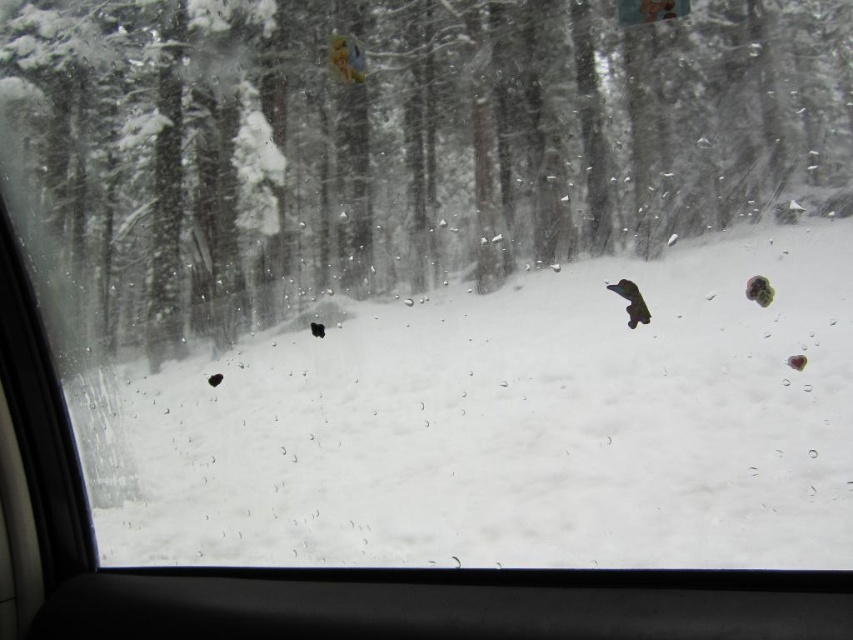
Is snowy bark tree at center positioned behind white matte snow at center?

No, it is not.

Which is behind, point (403, 4) or point (758, 465)?

Positioned behind is point (403, 4).

The width and height of the screenshot is (853, 640). I want to click on snowy bark tree at center, so click(x=395, y=140).

Is the position of snowy bark tree at center more distant than that of green fuzzy animal at right?

No, it is in front of green fuzzy animal at right.

Where is `snowy bark tree at center`? Image resolution: width=853 pixels, height=640 pixels. snowy bark tree at center is located at coordinates (395, 140).

Between white matte snow at center and black matte dog at center, which one is positioned lower?

white matte snow at center

This screenshot has height=640, width=853. What are the coordinates of `white matte snow at center` in the screenshot? It's located at (520, 426).

This screenshot has height=640, width=853. In order to click on white matte snow at center in this screenshot , I will do `click(520, 426)`.